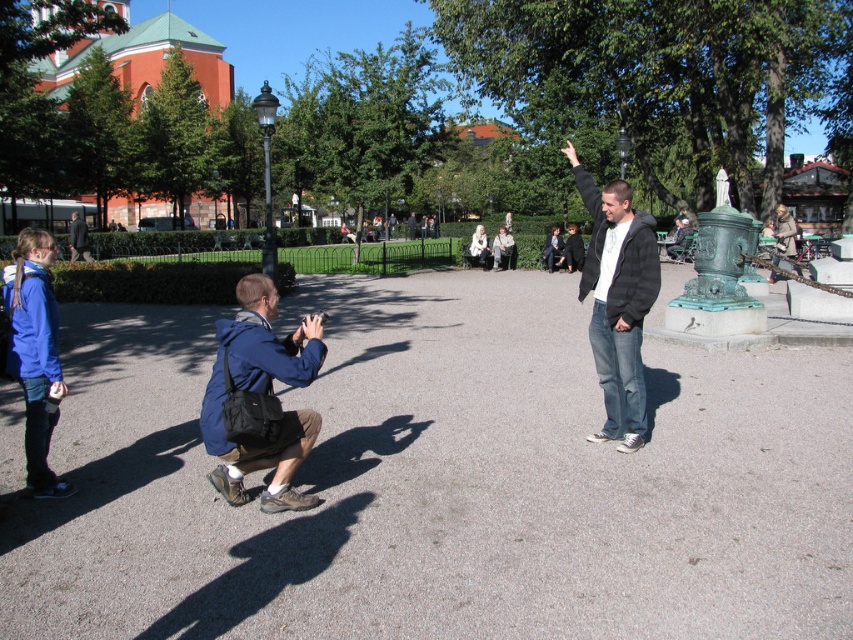
In the scene shown: Is black hoodie at center wider than dark blue jacket at center?

Incorrect, black hoodie at center's width does not surpass dark blue jacket at center's.

Does black hoodie at center appear on the right side of dark blue jacket at center?

Yes, black hoodie at center is to the right of dark blue jacket at center.

Which is in front, point (602, 198) or point (86, 237)?

Positioned in front is point (602, 198).

Image resolution: width=853 pixels, height=640 pixels. What are the coordinates of `black hoodie at center` in the screenshot? It's located at (618, 301).

Between blue fabric jacket at lower left and blue denim jacket at lower left, which one has more height?

blue fabric jacket at lower left

Is blue fabric jacket at lower left to the left of blue denim jacket at lower left from the viewer's perspective?

Incorrect, blue fabric jacket at lower left is not on the left side of blue denim jacket at lower left.

What do you see at coordinates (260, 397) in the screenshot?
I see `blue fabric jacket at lower left` at bounding box center [260, 397].

This screenshot has width=853, height=640. I want to click on blue fabric jacket at lower left, so click(260, 397).

Who is more distant from viewer, (317,364) or (624,410)?

Positioned behind is point (624,410).

Does blue fabric jacket at lower left appear over black hoodie at center?

No, blue fabric jacket at lower left is not above black hoodie at center.

The image size is (853, 640). What do you see at coordinates (260, 397) in the screenshot?
I see `blue fabric jacket at lower left` at bounding box center [260, 397].

Locate an element on the screen. This screenshot has height=640, width=853. blue fabric jacket at lower left is located at coordinates (260, 397).